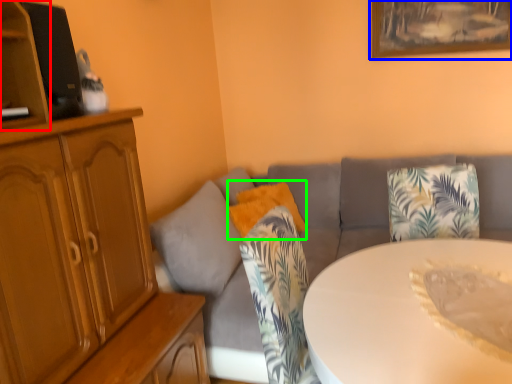
Question: Which object is the farthest from shelf (highlighted by a red box)? Choose among these: picture frame (highlighted by a blue box) or pillow (highlighted by a green box).

Choices:
 (A) picture frame
 (B) pillow

Answer: (A)